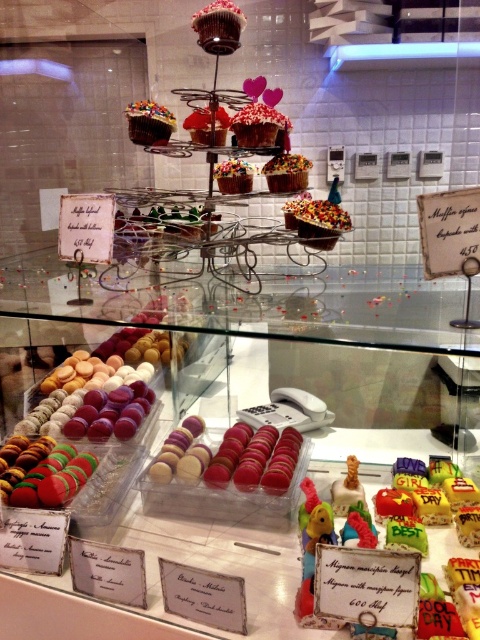
Does glazed chocolate cupcake at upper center have a smaller size compared to chocolate frosted cupcake at center?

Incorrect, glazed chocolate cupcake at upper center is not smaller in size than chocolate frosted cupcake at center.

Between glazed chocolate cupcake at upper center and chocolate frosted cupcake at center, which one has less height?

glazed chocolate cupcake at upper center

Is point (214, 33) positioned behind point (167, 125)?

No, (214, 33) is in front of (167, 125).

Identify the location of glazed chocolate cupcake at upper center. Image resolution: width=480 pixels, height=640 pixels. (218, 26).

Is point (49, 461) closer to viewer compared to point (337, 221)?

No, it is not.

Is multicolored macarons at lower left in front of sprinkled chocolate cupcake at center?

No, it is not.

Which is behind, point (64, 445) or point (339, 209)?

The point (64, 445) is more distant.

Find the location of `multicolored macarons at lower left`. multicolored macarons at lower left is located at coordinates (54, 477).

Is point (269, 161) positioned in front of point (196, 132)?

That is True.

Describe the element at coordinates (287, 172) in the screenshot. This screenshot has height=640, width=480. I see `multicolored sprinkles cupcake at center` at that location.

Is point (271, 161) positioned behind point (200, 129)?

No.

Locate an element on the screen. This screenshot has width=480, height=640. multicolored sprinkles cupcake at center is located at coordinates (287, 172).